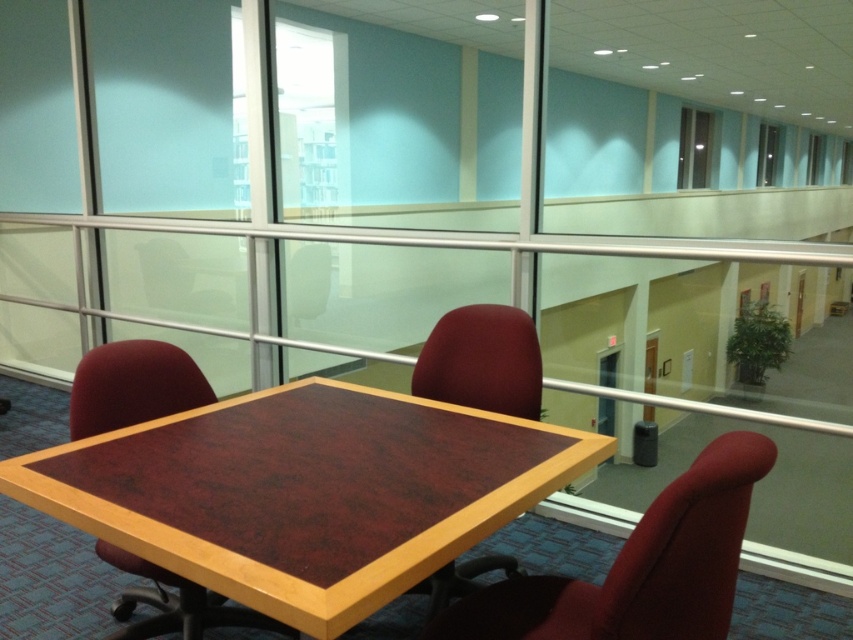
Where is `mahogany wood table at center`? Image resolution: width=853 pixels, height=640 pixels. mahogany wood table at center is located at coordinates (305, 492).

Measure the distance between mahogany wood table at center and camera.

3.62 feet

Find the location of `mahogany wood table at center`. mahogany wood table at center is located at coordinates pyautogui.click(x=305, y=492).

Find the location of a particular element. mahogany wood table at center is located at coordinates 305,492.

Find the location of `mahogany wood table at center`. mahogany wood table at center is located at coordinates (305, 492).

Find the location of a particular element. mahogany wood table at center is located at coordinates (305, 492).

Between matte red swivel chair at center and mahogany wood chair at center, which one is positioned higher?

Positioned higher is matte red swivel chair at center.

Is matte red swivel chair at center shorter than mahogany wood chair at center?

No, matte red swivel chair at center is not shorter than mahogany wood chair at center.

Find the location of a particular element. matte red swivel chair at center is located at coordinates (639, 566).